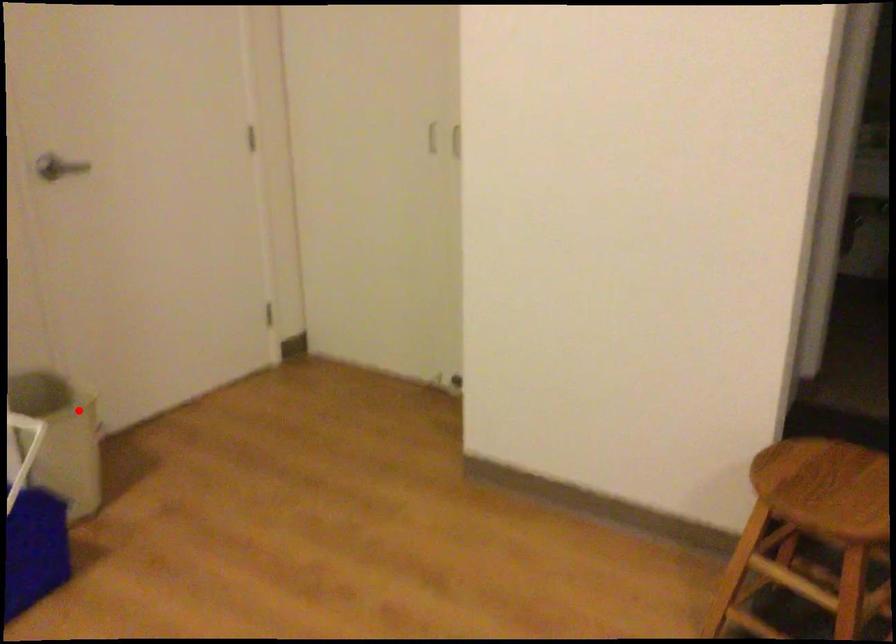
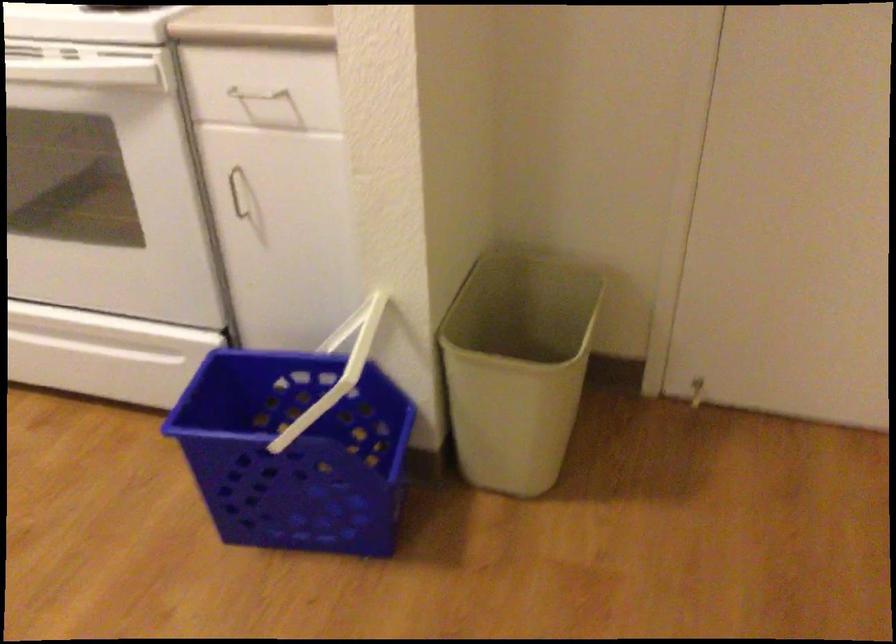
Where in the second image is the point corresponding to the highlighted location from the first image?

(517, 366)